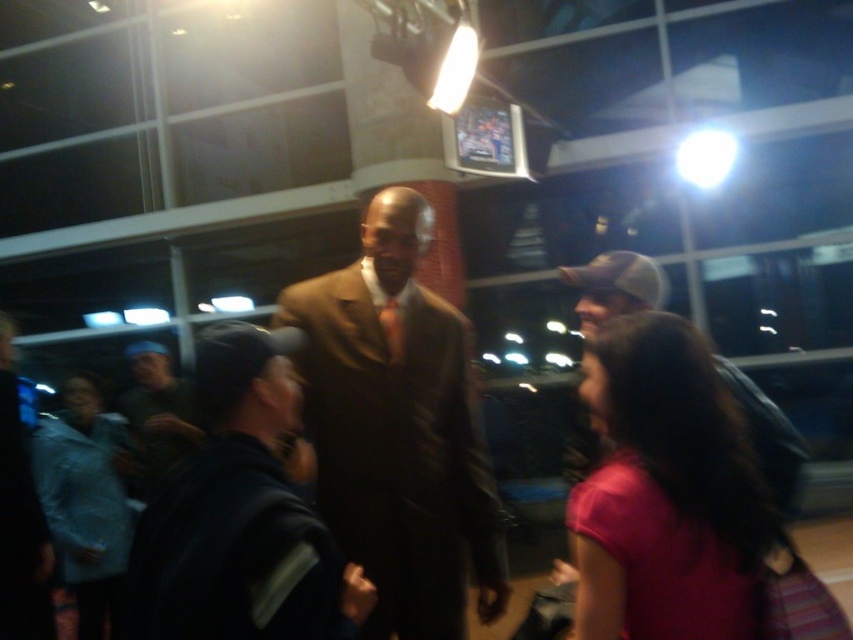
Question: Can you confirm if pink fabric shirt at center is thinner than light blue fabric jacket at lower left?

Choices:
 (A) no
 (B) yes

Answer: (B)

Question: Which point appears closest to the camera in this image?

Choices:
 (A) (77, 589)
 (B) (691, 358)

Answer: (B)

Question: Considering the real-world distances, which object is closest to the brown suit at center?

Choices:
 (A) light blue fabric jacket at lower left
 (B) pink fabric shirt at center

Answer: (B)

Question: Is pink fabric shirt at center positioned behind brown silk tie at center?

Choices:
 (A) no
 (B) yes

Answer: (A)

Question: Estimate the real-world distances between objects in this image. Which object is farther from the brown suit at center?

Choices:
 (A) light blue fabric jacket at lower left
 (B) brown silk tie at center

Answer: (A)

Question: Observing the image, what is the correct spatial positioning of brown suit at center in reference to light blue fabric jacket at lower left?

Choices:
 (A) right
 (B) left

Answer: (A)